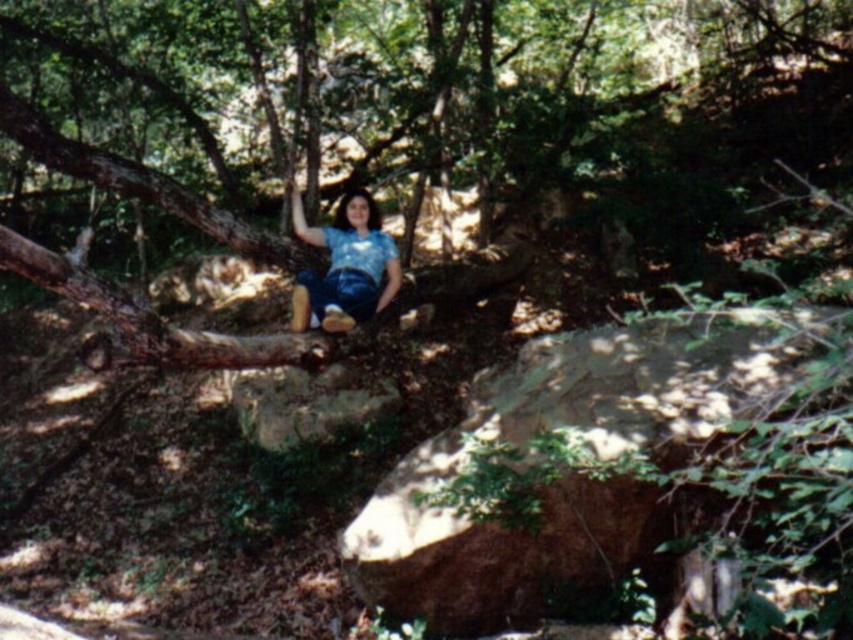
Between brown rough rock at lower center and blue denim jeans at center, which one appears on the left side from the viewer's perspective?

blue denim jeans at center

Is point (624, 356) behind point (383, 266)?

No, (624, 356) is in front of (383, 266).

Between point (640, 522) and point (340, 228), which one is positioned behind?

Positioned behind is point (340, 228).

Image resolution: width=853 pixels, height=640 pixels. Identify the location of brown rough rock at lower center. (570, 481).

Looking at this image, can you confirm if brown rough tree trunk at left is shorter than blue denim jeans at center?

Yes.

Who is shorter, brown rough tree trunk at left or blue denim jeans at center?

With less height is brown rough tree trunk at left.

The width and height of the screenshot is (853, 640). I want to click on brown rough tree trunk at left, so click(151, 321).

Image resolution: width=853 pixels, height=640 pixels. Describe the element at coordinates (570, 481) in the screenshot. I see `brown rough rock at lower center` at that location.

Image resolution: width=853 pixels, height=640 pixels. I want to click on brown rough rock at lower center, so click(x=570, y=481).

Is point (451, 545) farther from camera compared to point (326, 342)?

That is False.

Find the location of a particular element. Image resolution: width=853 pixels, height=640 pixels. brown rough rock at lower center is located at coordinates (570, 481).